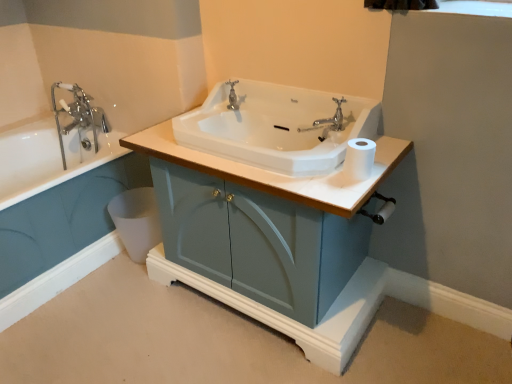
Question: Relative to polished chrome faucet at center, is matte blue cabinet at center in front or behind?

Choices:
 (A) behind
 (B) front

Answer: (B)

Question: Is matte blue cabinet at center wider or thinner than polished chrome faucet at center?

Choices:
 (A) thin
 (B) wide

Answer: (B)

Question: Considering the real-world distances, which object is farthest from the matte blue cabinet at center?

Choices:
 (A) white glossy bathtub at left
 (B) white matte toilet paper at right
 (C) chrome metallic faucet at upper left
 (D) white plastic toilet bowl at lower left
 (E) polished chrome faucet at center

Answer: (C)

Question: Which is nearer to the white glossy bathtub at left?

Choices:
 (A) white matte toilet paper at right
 (B) white plastic toilet bowl at lower left
 (C) chrome metallic faucet at upper left
 (D) polished chrome faucet at center
 (E) white glossy sink at center

Answer: (C)